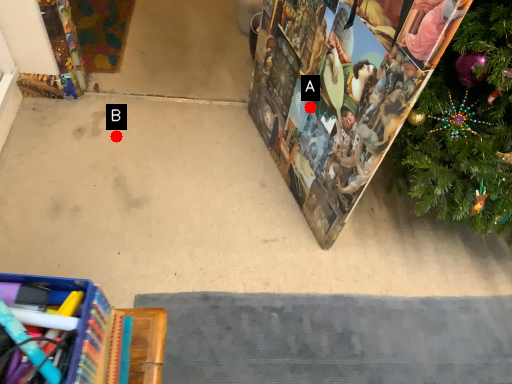
Question: Two points are circled on the image, labeled by A and B beside each circle. Which point appears closest to the camera in this image?

Choices:
 (A) A is closer
 (B) B is closer

Answer: (A)